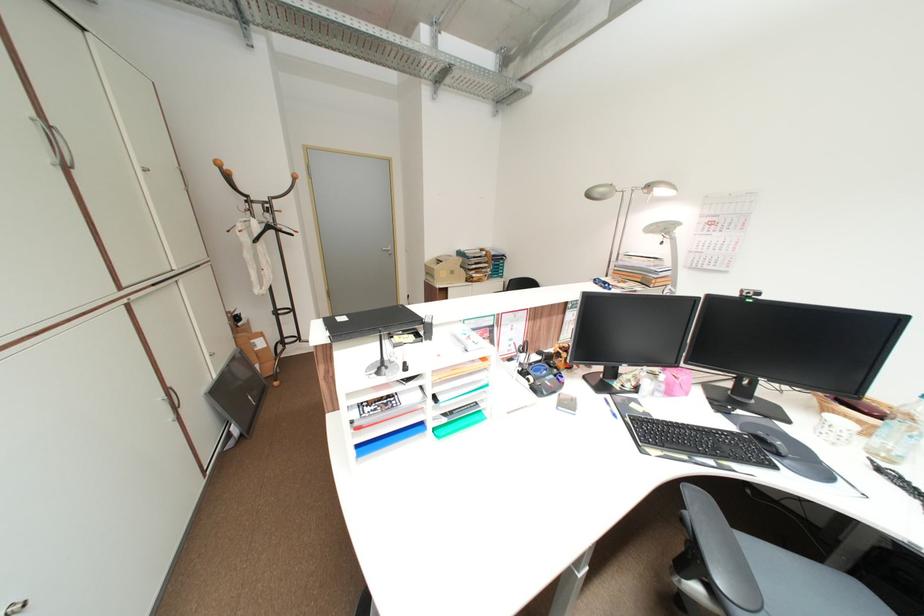
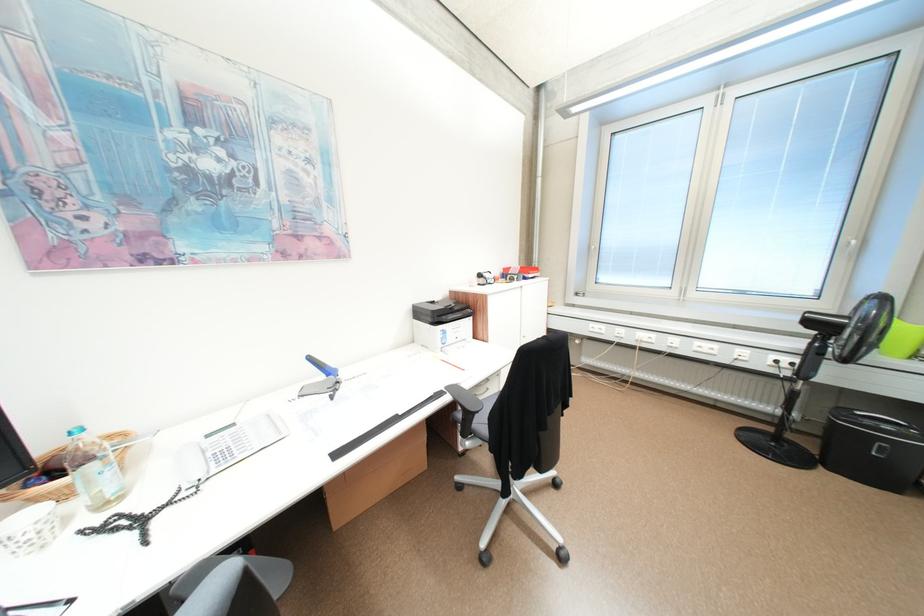
Find the pixel in the second image that matches (x=834, y=410) in the first image.

(43, 499)